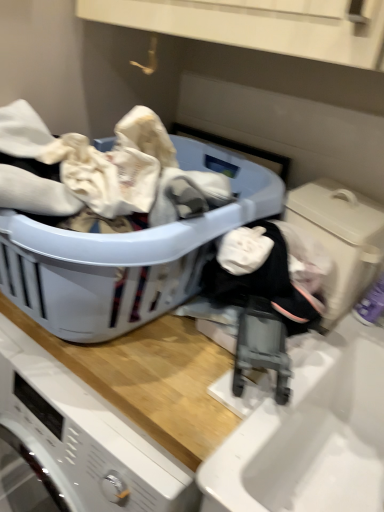
Question: Is plastic laundry basket at center wider or thinner than beige plastic washing machine at lower right?

Choices:
 (A) thin
 (B) wide

Answer: (B)

Question: From a real-world perspective, relative to beige plastic washing machine at lower right, is plastic laundry basket at center vertically above or below?

Choices:
 (A) below
 (B) above

Answer: (A)

Question: Considering the positions of plastic laundry basket at center and beige plastic washing machine at lower right in the image, is plastic laundry basket at center bigger or smaller than beige plastic washing machine at lower right?

Choices:
 (A) small
 (B) big

Answer: (B)

Question: Looking at their shapes, would you say beige plastic washing machine at lower right is wider or thinner than plastic laundry basket at center?

Choices:
 (A) wide
 (B) thin

Answer: (B)

Question: Is point (354, 238) closer or farther from the camera than point (91, 254)?

Choices:
 (A) farther
 (B) closer

Answer: (A)

Question: Considering the relative positions of beige plastic washing machine at lower right and plastic laundry basket at center in the image provided, is beige plastic washing machine at lower right to the left or to the right of plastic laundry basket at center?

Choices:
 (A) right
 (B) left

Answer: (A)

Question: From a real-world perspective, relative to plastic laundry basket at center, is beige plastic washing machine at lower right vertically above or below?

Choices:
 (A) above
 (B) below

Answer: (A)